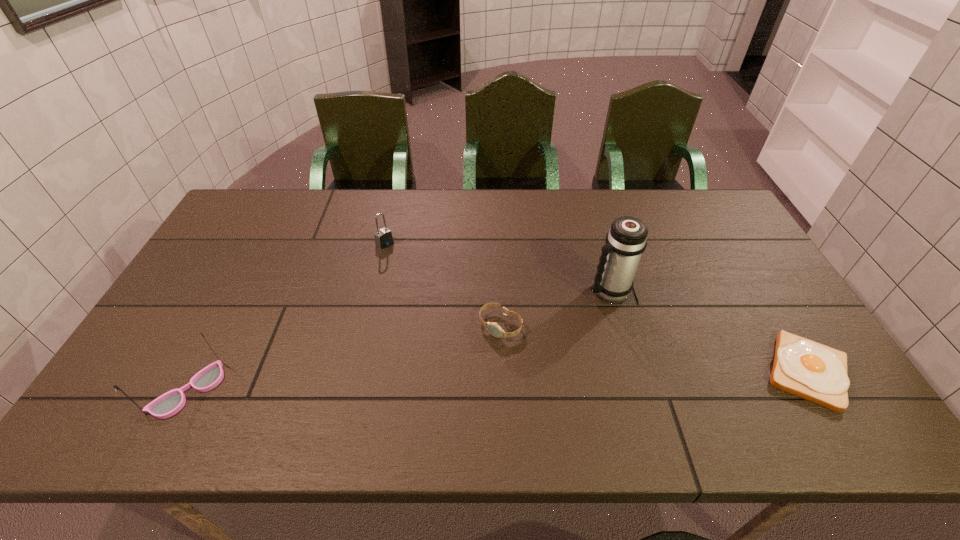
Where is `free space on the desktop that is between the second tallest object and the shortest object and is positioned on the shackle of the padlock`? The image size is (960, 540). free space on the desktop that is between the second tallest object and the shortest object and is positioned on the shackle of the padlock is located at coordinates (556, 379).

This screenshot has height=540, width=960. I want to click on vacant space on the desktop that is between the leftmost object and the toast and is positioned on the side with the handle of the fourth nearest object, so click(x=477, y=382).

You are a GUI agent. You are given a task and a screenshot of the screen. Output one action in this format:
    pyautogui.click(x=<x>, y=<y>)
    Task: Click on the vacant spot on the desktop that is between the leftmost object and the rightmost object and is positioned on the face of the third object from right to left
    The height and width of the screenshot is (540, 960).
    Given the screenshot: What is the action you would take?
    pyautogui.click(x=452, y=383)